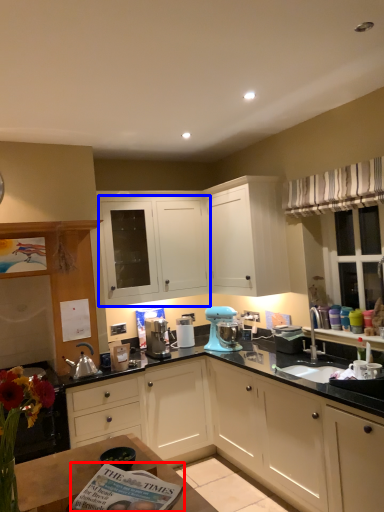
Question: Among these objects, which one is nearest to the camera, magazine (highlighted by a red box) or cabinetry (highlighted by a blue box)?

Choices:
 (A) magazine
 (B) cabinetry

Answer: (A)